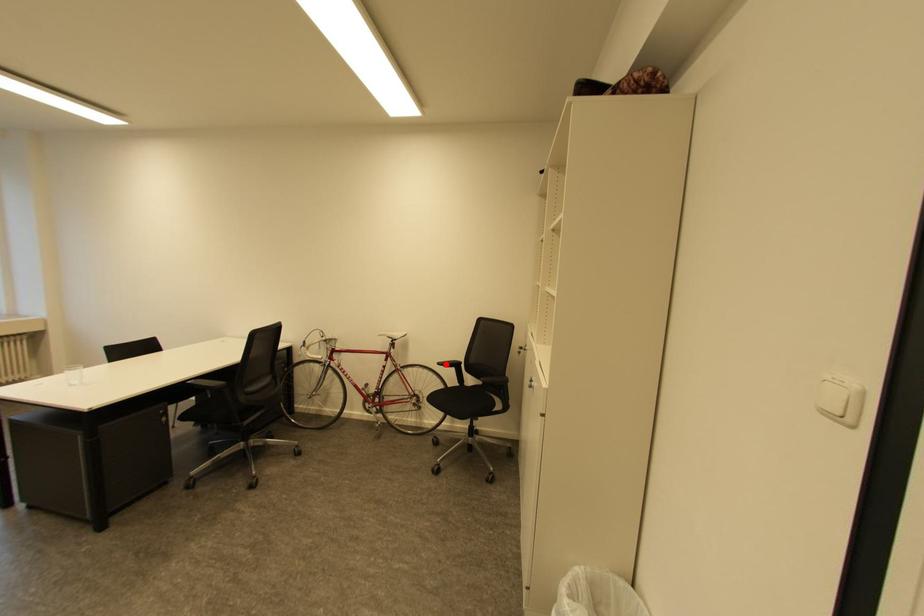
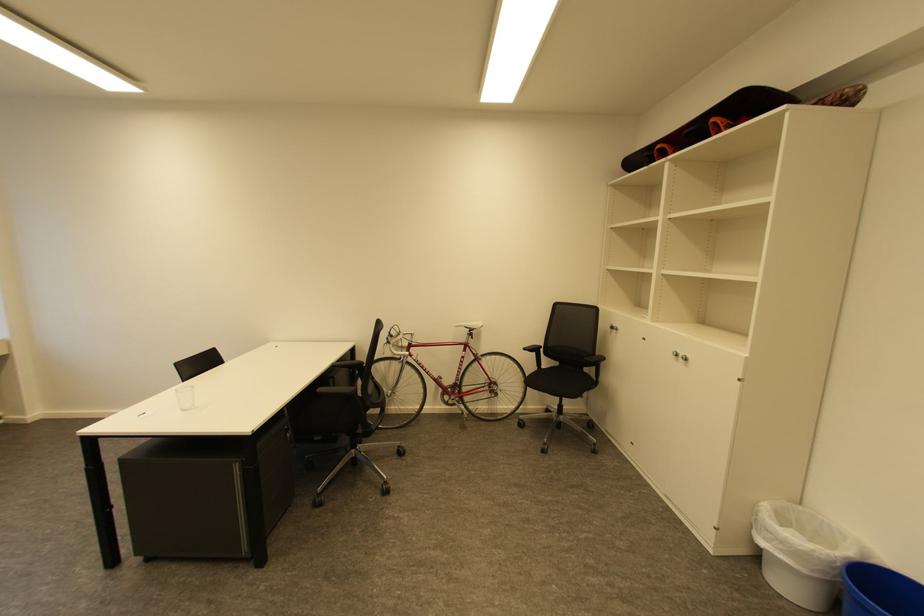
In the second image, find the point that corresponds to the highlighted location in the first image.

(531, 350)